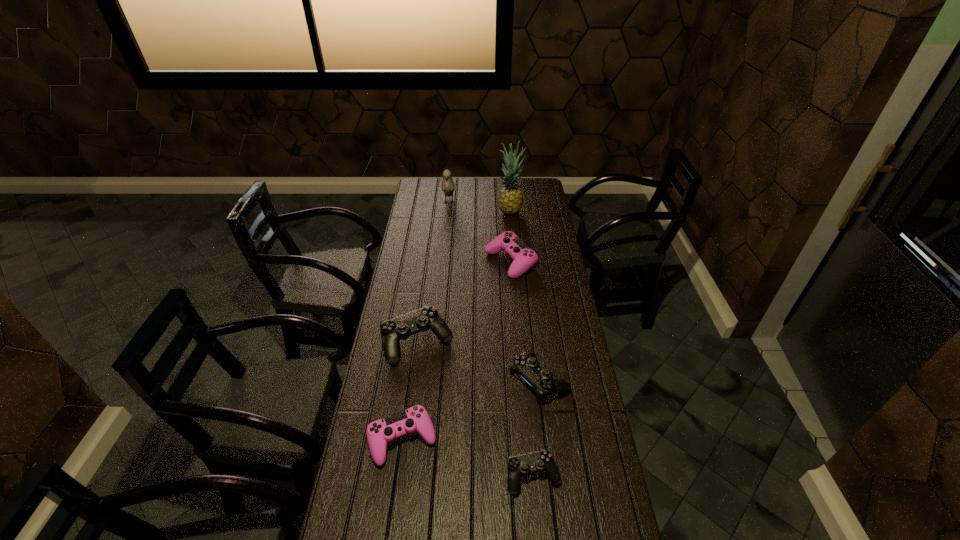
I want to click on yellow pineapple, so click(510, 199).

The image size is (960, 540). Find the location of `pineapple`. pineapple is located at coordinates (510, 199).

Where is `the sixth shortest object`? This screenshot has height=540, width=960. the sixth shortest object is located at coordinates tap(448, 186).

Locate an element on the screen. white bird is located at coordinates (448, 186).

Locate an element on the screen. This screenshot has width=960, height=540. the biggest black control is located at coordinates (401, 327).

Find the location of a particular element. the bigger pink control is located at coordinates (524, 258).

The width and height of the screenshot is (960, 540). I want to click on the fifth nearest object, so click(524, 258).

In order to click on the second smallest black control in this screenshot , I will do `click(526, 365)`.

Identify the location of the smaller pink control. (415, 419).

Locate an element on the screen. This screenshot has width=960, height=540. the left pink control is located at coordinates (415, 419).